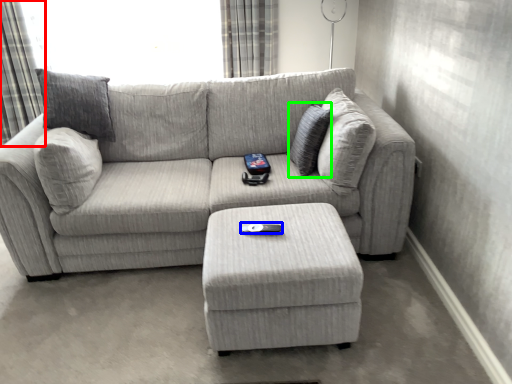
Question: Based on their relative distances, which object is nearer to curtain (highlighted by a red box)? Choose from remote (highlighted by a blue box) and pillow (highlighted by a green box).

Choices:
 (A) remote
 (B) pillow

Answer: (B)